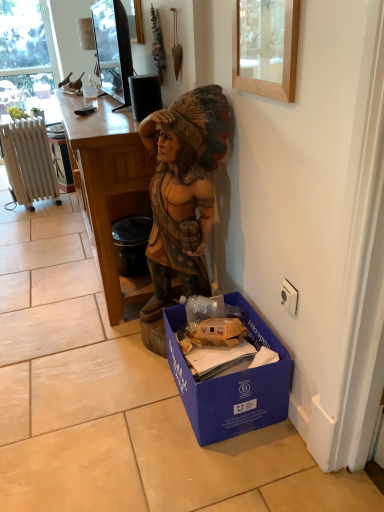
Image resolution: width=384 pixels, height=512 pixels. I want to click on vacant region to the left of blue cardboard box at lower right, so click(128, 397).